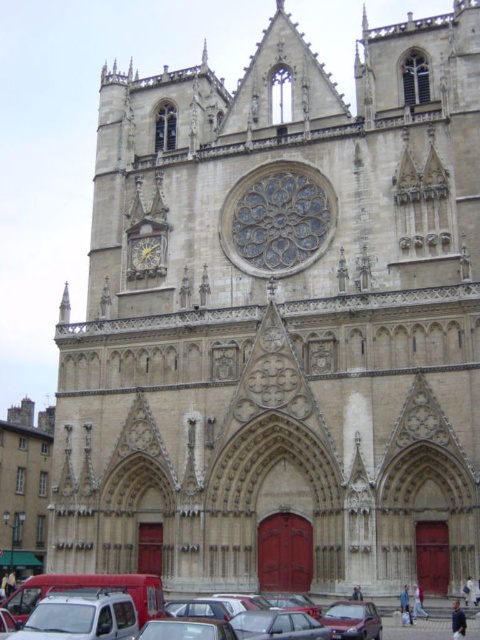
Between point (280, 608) and point (144, 248), which one is positioned behind?

The point (144, 248) is behind.

Can you confirm if metallic silver car at center is bigger than gold metallic clock at center-left?

Indeed, metallic silver car at center has a larger size compared to gold metallic clock at center-left.

Locate an element on the screen. This screenshot has height=640, width=480. metallic silver car at center is located at coordinates (336, 614).

Measure the distance between metallic silver car at center and matte black car at center.

metallic silver car at center is 6.99 meters away from matte black car at center.

Is metallic silver car at center behind matte black car at center?

No, it is in front of matte black car at center.

Is point (92, 577) more distant than point (337, 620)?

Yes, point (92, 577) is behind point (337, 620).

Locate an element on the screen. The image size is (480, 640). metallic silver car at center is located at coordinates (336, 614).

Consider the image. Does matte black car at center have a lesser height compared to gold metallic clock at center-left?

Yes, matte black car at center is shorter than gold metallic clock at center-left.

Who is lower down, matte black car at center or gold metallic clock at center-left?

matte black car at center is below.

Does point (369, 616) lie behind point (133, 259)?

No, (369, 616) is closer to viewer.

Where is `matte black car at center`? matte black car at center is located at coordinates (352, 620).